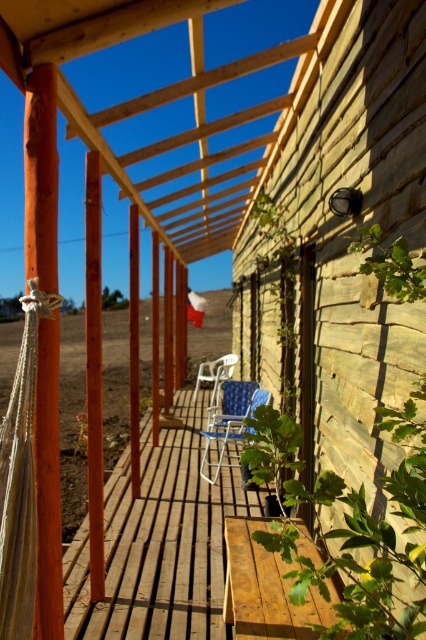
Between blue woven chair at center and white plastic chair at center, which one appears on the right side from the viewer's perspective?

white plastic chair at center

Which is in front, point (233, 422) or point (201, 372)?

Point (233, 422)

Which is behind, point (224, 445) or point (209, 378)?

Point (209, 378)

At what (x,y) coordinates should I click in order to perform the action: click on blue woven chair at center. Please return your answer as a coordinate pair (x, y). Looking at the image, I should click on (229, 429).